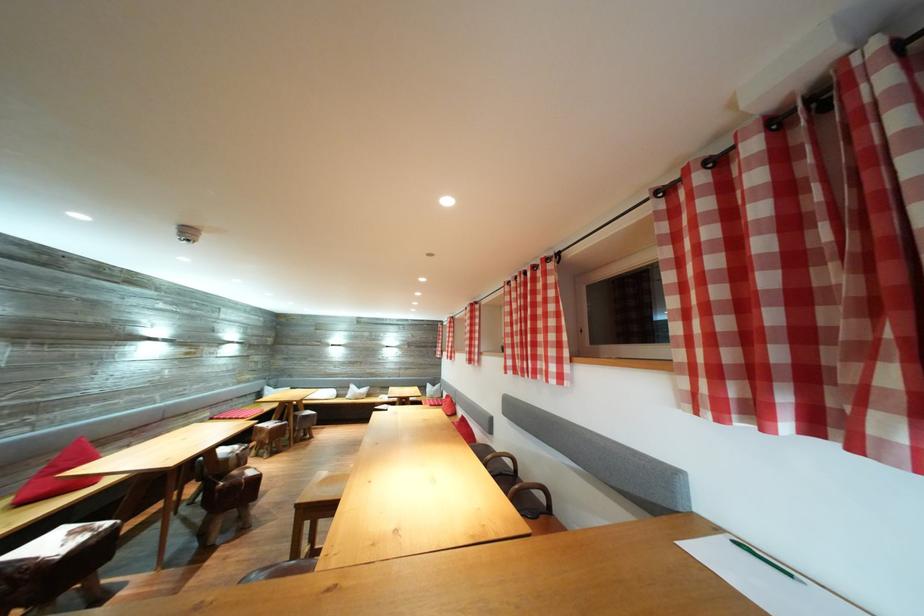
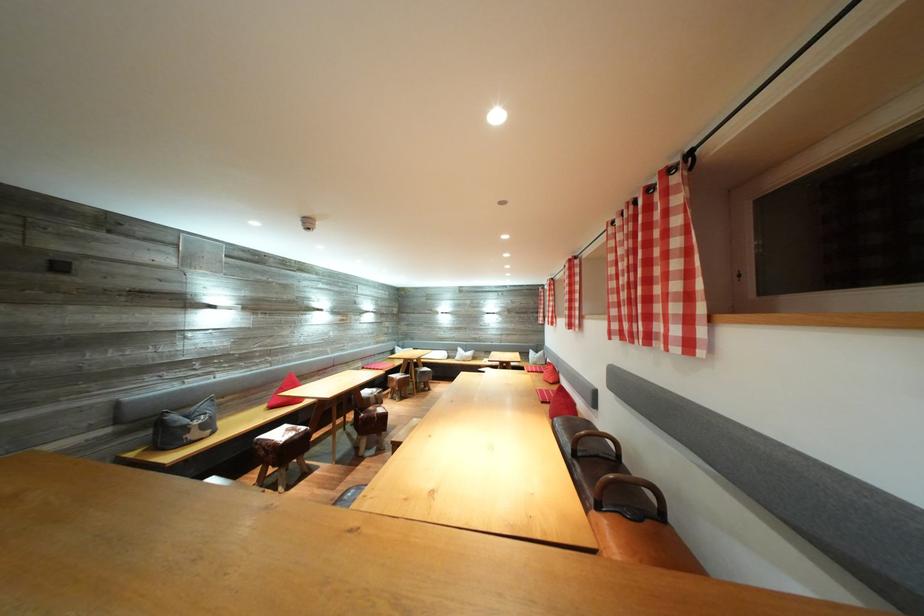
Question: The camera is either moving clockwise (left) or counter-clockwise (right) around the object. The first image is from the beginning of the video and the second image is from the end. Is the camera moving left or right when shooting the video?

Choices:
 (A) Left
 (B) Right

Answer: (B)